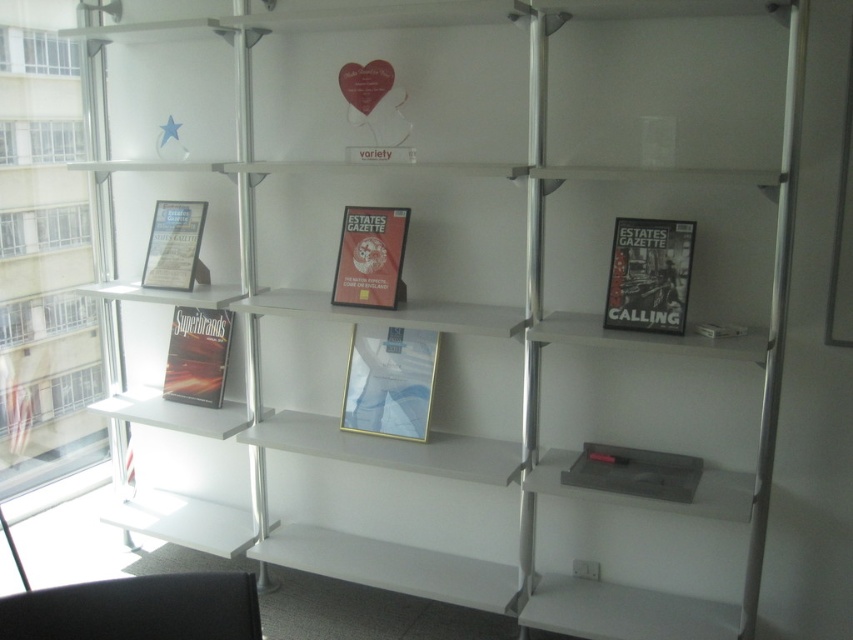
Image resolution: width=853 pixels, height=640 pixels. Identify the location of matte black book at left. (196, 355).

Which is in front, point (183, 397) or point (194, 276)?

Point (194, 276)

Find the location of `matte black book at left`. matte black book at left is located at coordinates (196, 355).

From the picture: Can you confirm if matte black book at right is positioned to the left of matte black magazine at left?

In fact, matte black book at right is to the right of matte black magazine at left.

Is matte black book at right thinner than matte black magazine at left?

Indeed, matte black book at right has a lesser width compared to matte black magazine at left.

Between point (656, 259) and point (148, 248), which one is positioned in front?

Point (656, 259) is more forward.

Identify the location of matte black book at right. (648, 275).

Can you confirm if matte gold frame at center is positioned to the right of matte black book at right?

Incorrect, matte gold frame at center is not on the right side of matte black book at right.

Does point (409, 333) lie in front of point (657, 228)?

That is False.

Between point (373, 339) and point (646, 236), which one is positioned behind?

Point (373, 339)

You are a GUI agent. You are given a task and a screenshot of the screen. Output one action in this format:
    pyautogui.click(x=<x>, y=<y>)
    Task: Click on the matte gold frame at center
    
    Given the screenshot: What is the action you would take?
    pyautogui.click(x=389, y=381)